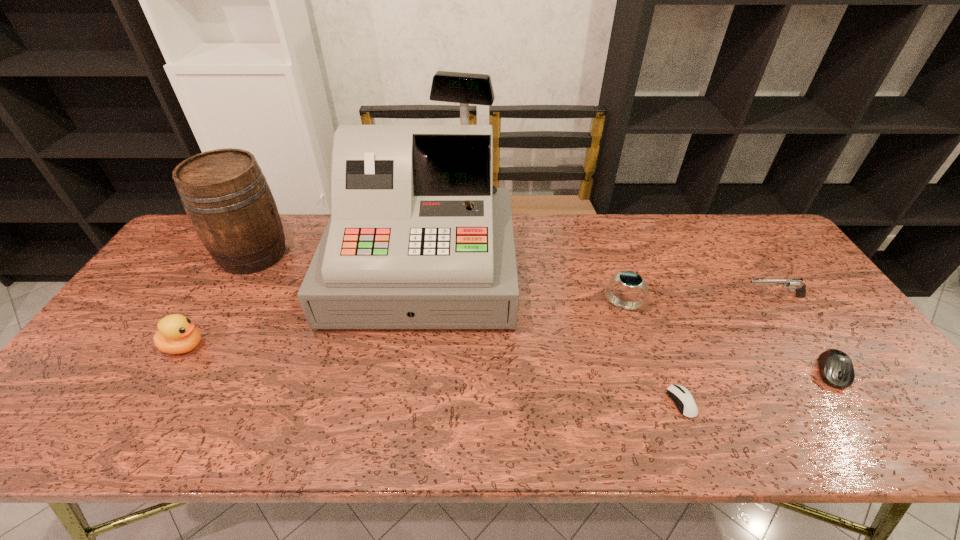
The height and width of the screenshot is (540, 960). I want to click on cider that is at the far edge, so click(x=228, y=201).

Where is `object located at the near edge`? This screenshot has width=960, height=540. object located at the near edge is located at coordinates (683, 399).

At what (x,y) coordinates should I click in order to perform the action: click on cider present at the left edge. Please return your answer as a coordinate pair (x, y). Looking at the image, I should click on (228, 201).

Locate an element on the screen. The width and height of the screenshot is (960, 540). duckling situated at the left edge is located at coordinates (177, 334).

This screenshot has width=960, height=540. What are the coordinates of `pistol at the right edge` in the screenshot? It's located at (797, 285).

Identify the location of mouse present at the right edge. The image size is (960, 540). (836, 369).

Locate an element on the screen. This screenshot has height=540, width=960. object that is at the far left corner is located at coordinates (228, 201).

Locate an element on the screen. This screenshot has width=960, height=540. free space at the far edge of the desktop is located at coordinates (551, 243).

Identify the location of vacant space at the near edge. The width and height of the screenshot is (960, 540). (481, 416).

Identify the location of vacant space at the right edge of the desktop. (814, 367).